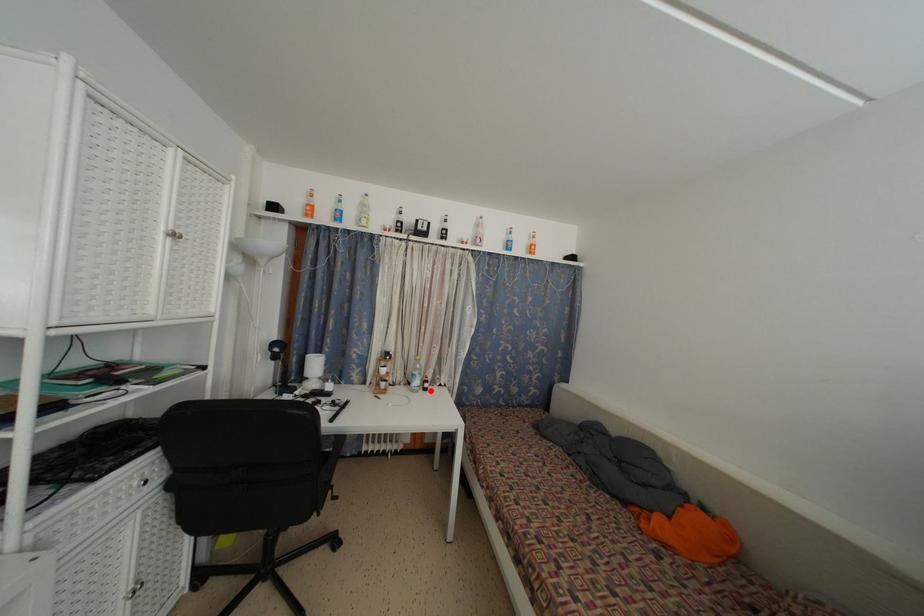
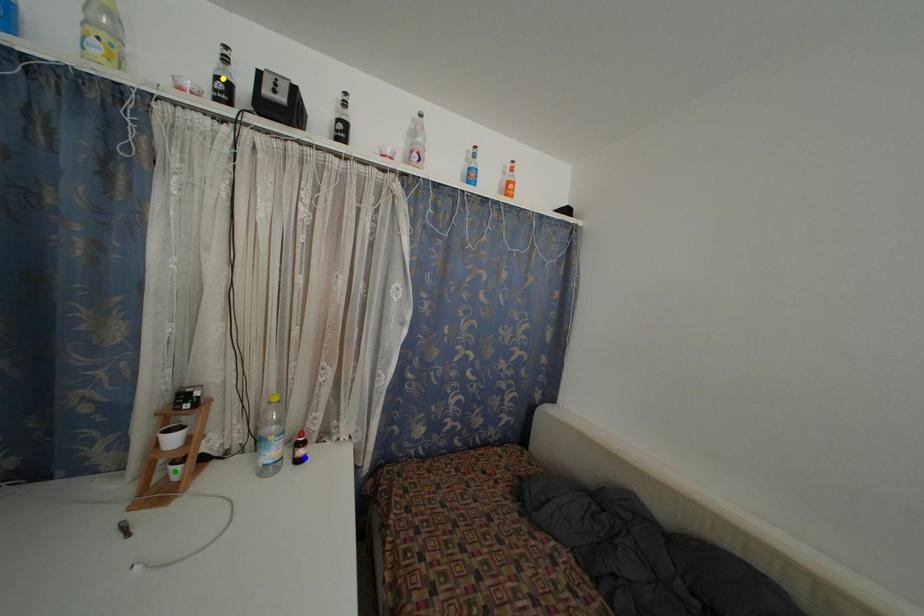
Question: I am providing you with two images of the same scene from different viewpoints. A red point is marked on the first image. You are given multiple points on the second image. Which mark in image 2 goes with the point in image 1?

Choices:
 (A) green point
 (B) blue point
 (C) yellow point

Answer: (B)